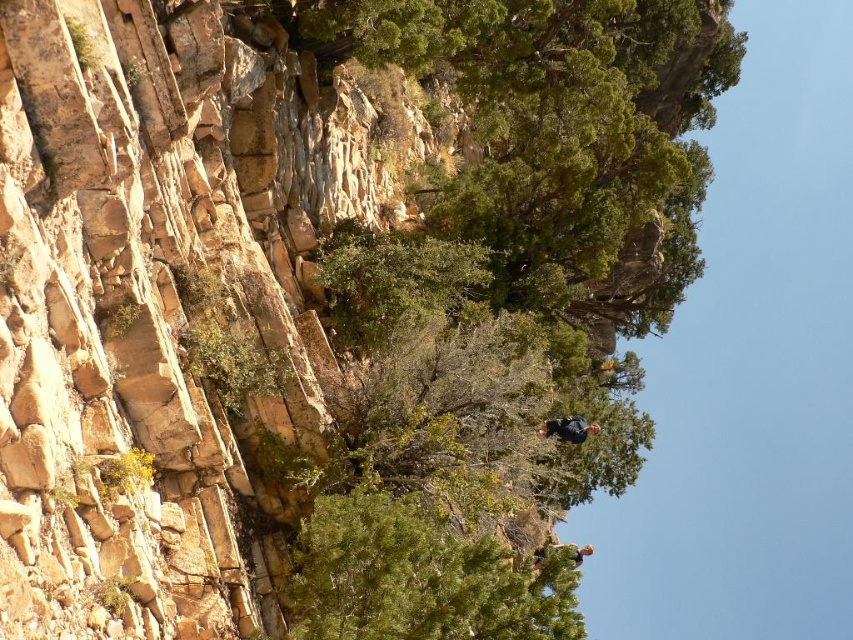
Question: Considering the relative positions of green leafy tree at center and green fabric climber at lower center in the image provided, where is green leafy tree at center located with respect to green fabric climber at lower center?

Choices:
 (A) above
 (B) below

Answer: (A)

Question: Which point is closer to the camera?

Choices:
 (A) green leafy tree at center
 (B) green fabric climber at lower center
 (C) dark blue fabric at center

Answer: (A)

Question: Which point appears farthest from the camera in this image?

Choices:
 (A) (540, 433)
 (B) (572, 230)
 (C) (572, 547)

Answer: (B)

Question: Which of these objects is positioned closest to the green fabric climber at lower center?

Choices:
 (A) green leafy tree at center
 (B) dark blue fabric at center

Answer: (B)

Question: Is green leafy tree at center to the right of green fabric climber at lower center from the viewer's perspective?

Choices:
 (A) no
 (B) yes

Answer: (A)

Question: Does dark blue fabric at center appear over green fabric climber at lower center?

Choices:
 (A) yes
 (B) no

Answer: (A)